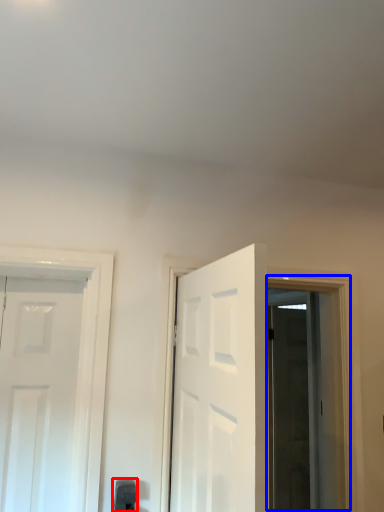
Question: Which object is closer to the camera taking this photo, door handle (highlighted by a red box) or window (highlighted by a blue box)?

Choices:
 (A) door handle
 (B) window

Answer: (A)